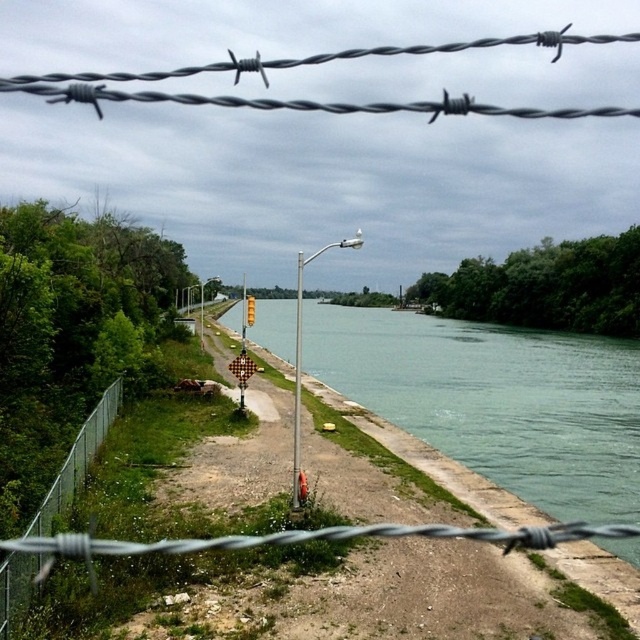
Question: Is barbed wire at center to the left of green chain-link fence at lower left from the viewer's perspective?

Choices:
 (A) yes
 (B) no

Answer: (B)

Question: Which of the following is the farthest from the observer?

Choices:
 (A) (49, 538)
 (B) (38, 568)
 (C) (516, 477)
 (D) (326, 52)

Answer: (D)

Question: Which is nearer to the green concrete river at center?

Choices:
 (A) barbed wire at center
 (B) black twisted wire at upper center
 (C) green chain-link fence at lower left

Answer: (B)

Question: In this image, where is black twisted wire at upper center located relative to barbed wire at center?

Choices:
 (A) above
 (B) below

Answer: (A)

Question: Does green concrete river at center have a greater width compared to barbed wire at center?

Choices:
 (A) no
 (B) yes

Answer: (B)

Question: Which object appears farthest from the camera in this image?

Choices:
 (A) barbed wire at center
 (B) green chain-link fence at lower left
 (C) green concrete river at center

Answer: (C)